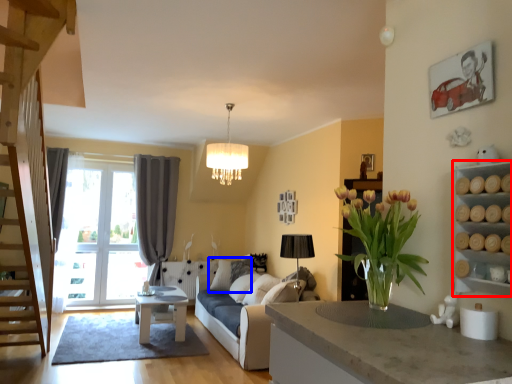
Question: Which of the following is the farthest to the observer, cabinet (highlighted by a red box) or pillow (highlighted by a blue box)?

Choices:
 (A) cabinet
 (B) pillow

Answer: (B)